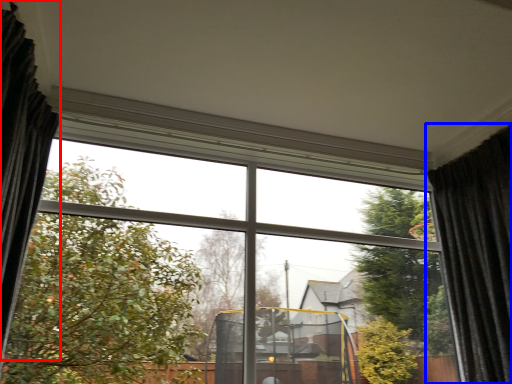
Question: Which of the following is the closest to the observer, curtain (highlighted by a red box) or curtain (highlighted by a blue box)?

Choices:
 (A) curtain
 (B) curtain

Answer: (A)